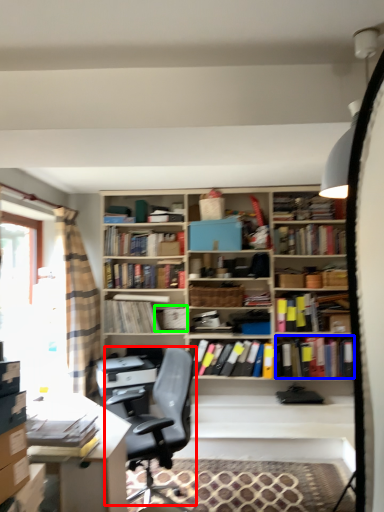
Question: Which is nearer to the chair (highlighted by a red box)? book (highlighted by a blue box) or book (highlighted by a green box).

Choices:
 (A) book
 (B) book

Answer: (B)